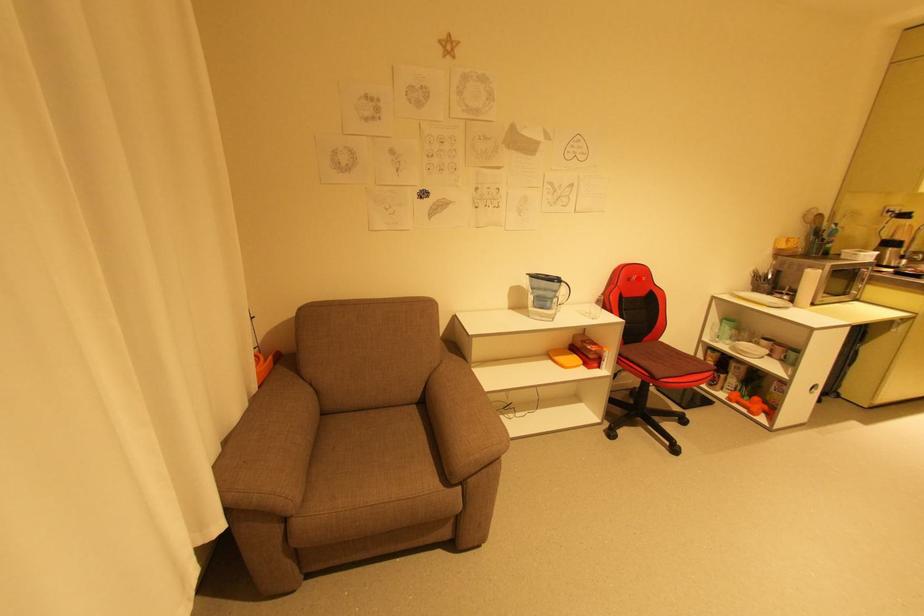
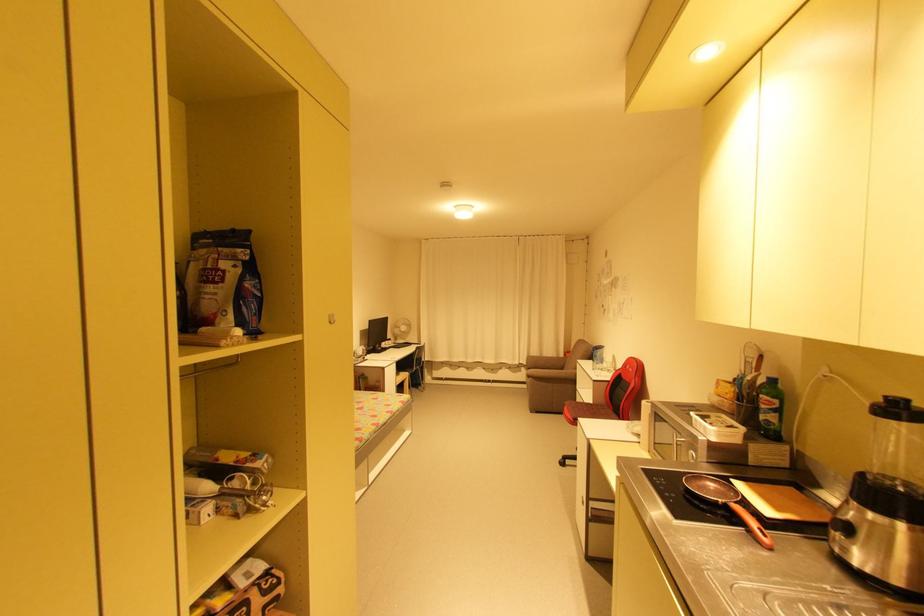
In the second image, find the point that corresponds to the highlighted location in the first image.

(631, 367)